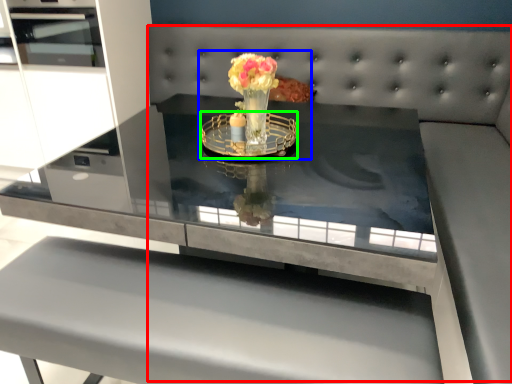
Question: Based on their relative distances, which object is nearer to couch (highlighted by a red box)? Choose from floral arrangement (highlighted by a blue box) and glass plate (highlighted by a green box).

Choices:
 (A) floral arrangement
 (B) glass plate

Answer: (B)